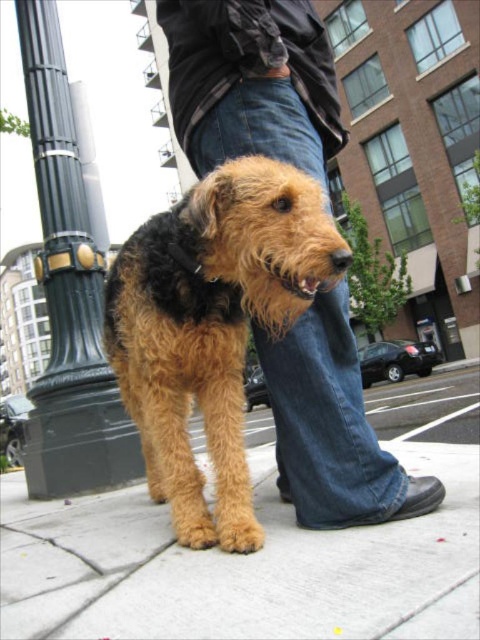
Who is positioned more to the right, brown concrete pavement at lower center or black metal pole at left?

From the viewer's perspective, brown concrete pavement at lower center appears more on the right side.

Between point (409, 636) and point (45, 67), which one is positioned behind?

Positioned behind is point (45, 67).

I want to click on brown concrete pavement at lower center, so click(x=260, y=552).

Can you confirm if fuzzy brown dog at center is positioned to the right of black metal pole at left?

Correct, you'll find fuzzy brown dog at center to the right of black metal pole at left.

Locate an element on the screen. fuzzy brown dog at center is located at coordinates (212, 326).

The height and width of the screenshot is (640, 480). Find the location of `fuzzy brown dog at center`. fuzzy brown dog at center is located at coordinates (212, 326).

Is fuzzy brown dog at center to the right of jeans at center from the viewer's perspective?

In fact, fuzzy brown dog at center is to the left of jeans at center.

What do you see at coordinates (212, 326) in the screenshot? I see `fuzzy brown dog at center` at bounding box center [212, 326].

Locate an element on the screen. fuzzy brown dog at center is located at coordinates (212, 326).

Locate an element on the screen. This screenshot has height=640, width=480. fuzzy brown dog at center is located at coordinates (212, 326).